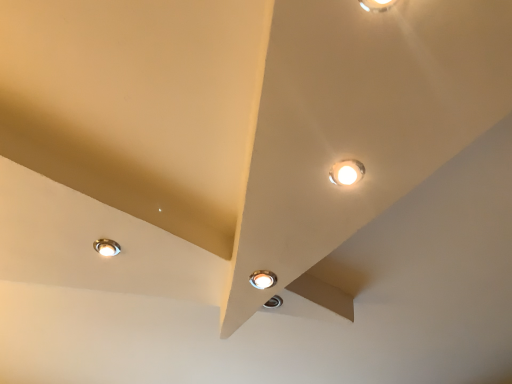
Question: Are matte white lamp at upper right, the 3th lamp when ordered from left to right, and matte silver lamp at center, which is the second lamp in back-to-front order, beside each other?

Choices:
 (A) no
 (B) yes

Answer: (A)

Question: Considering the relative positions of matte white lamp at upper right, the 3th lamp when ordered from left to right, and matte silver lamp at center, positioned as the second lamp in left-to-right order, in the image provided, is matte white lamp at upper right, the 3th lamp when ordered from left to right, in front of matte silver lamp at center, positioned as the second lamp in left-to-right order,?

Choices:
 (A) no
 (B) yes

Answer: (B)

Question: From a real-world perspective, is matte white lamp at upper right, placed as the third lamp when sorted from bottom to top, under matte silver lamp at center, which is the second lamp in back-to-front order?

Choices:
 (A) yes
 (B) no

Answer: (B)

Question: Is matte silver lamp at center, which is the second lamp from right to left, at the back of matte white lamp at upper right, the first lamp positioned from the front?

Choices:
 (A) yes
 (B) no

Answer: (B)

Question: Can you confirm if matte white lamp at upper right, placed as the third lamp when sorted from bottom to top, is bigger than matte silver lamp at center, the 3th lamp viewed from the top?

Choices:
 (A) yes
 (B) no

Answer: (A)

Question: Is matte white lamp at upper right, the 3th lamp when ordered from left to right, not near matte silver lamp at center, acting as the first lamp starting from the bottom?

Choices:
 (A) no
 (B) yes

Answer: (A)

Question: Are matte silver lamp at lower left, which appears as the first lamp when viewed from the back, and matte silver lamp at center, acting as the second lamp starting from the front, making contact?

Choices:
 (A) yes
 (B) no

Answer: (B)

Question: Can you confirm if matte silver lamp at lower left, the 2th lamp positioned from the bottom, is taller than matte silver lamp at center, positioned as the second lamp in left-to-right order?

Choices:
 (A) yes
 (B) no

Answer: (A)

Question: From the image's perspective, is matte silver lamp at lower left, positioned as the 3th lamp in right-to-left order, located beneath matte silver lamp at center, positioned as the second lamp in left-to-right order?

Choices:
 (A) yes
 (B) no

Answer: (B)

Question: Is the position of matte silver lamp at lower left, the 2th lamp positioned from the top, more distant than that of matte silver lamp at center, positioned as the second lamp in left-to-right order?

Choices:
 (A) yes
 (B) no

Answer: (A)

Question: Considering the relative positions of matte silver lamp at lower left, the third lamp positioned from the front, and matte silver lamp at center, acting as the second lamp starting from the front, in the image provided, is matte silver lamp at lower left, the third lamp positioned from the front, to the left of matte silver lamp at center, acting as the second lamp starting from the front, from the viewer's perspective?

Choices:
 (A) no
 (B) yes

Answer: (B)

Question: Is matte silver lamp at lower left, the 2th lamp positioned from the bottom, far from matte silver lamp at center, acting as the second lamp starting from the front?

Choices:
 (A) yes
 (B) no

Answer: (B)

Question: Does matte silver lamp at center, positioned as the second lamp in left-to-right order, have a greater width compared to matte white lamp at upper right, placed as the third lamp when sorted from bottom to top?

Choices:
 (A) yes
 (B) no

Answer: (A)